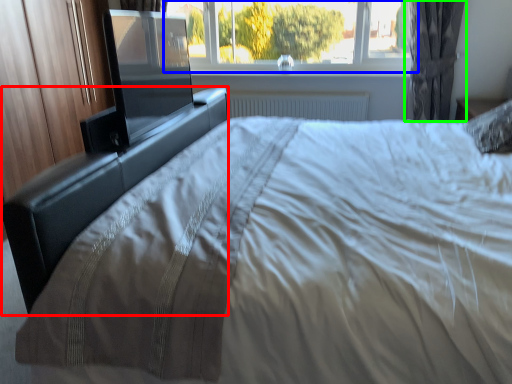
Question: Which object is positioned farthest from bed frame (highlighted by a red box)? Select from window (highlighted by a blue box) and curtain (highlighted by a green box).

Choices:
 (A) window
 (B) curtain

Answer: (B)